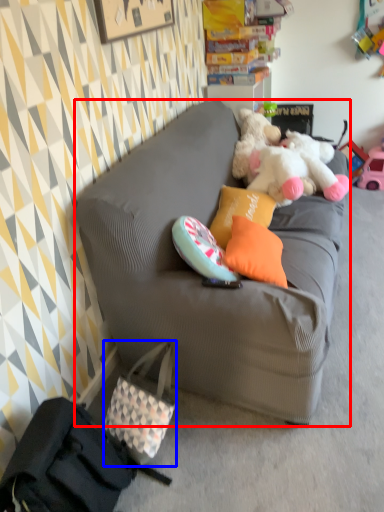
Question: Which object is further to the camera taking this photo, studio couch (highlighted by a red box) or handbag (highlighted by a blue box)?

Choices:
 (A) studio couch
 (B) handbag

Answer: (B)